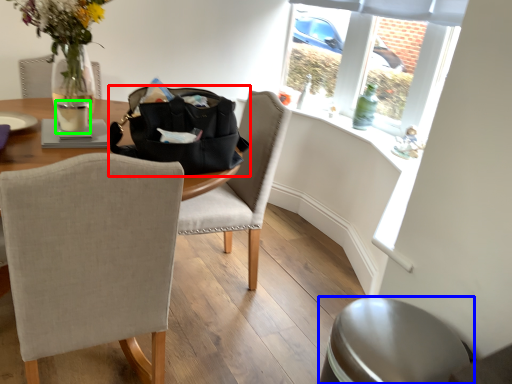
Question: Which object is the farthest from handbag (highlighted by a red box)? Choose among these: swivel chair (highlighted by a blue box) or beverage (highlighted by a green box).

Choices:
 (A) swivel chair
 (B) beverage

Answer: (A)